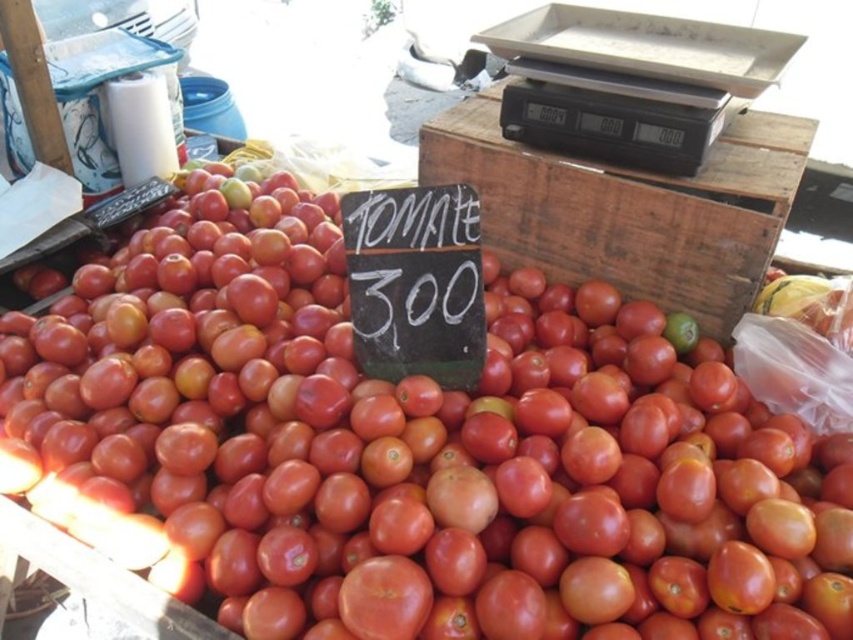
Does shiny red tomato at center have a larger size compared to wooden crate at center?

Yes, shiny red tomato at center is bigger than wooden crate at center.

Can you confirm if shiny red tomato at center is thinner than wooden crate at center?

In fact, shiny red tomato at center might be wider than wooden crate at center.

Does point (440, 404) come in front of point (805, 145)?

That is True.

The width and height of the screenshot is (853, 640). Identify the location of shiny red tomato at center. (410, 451).